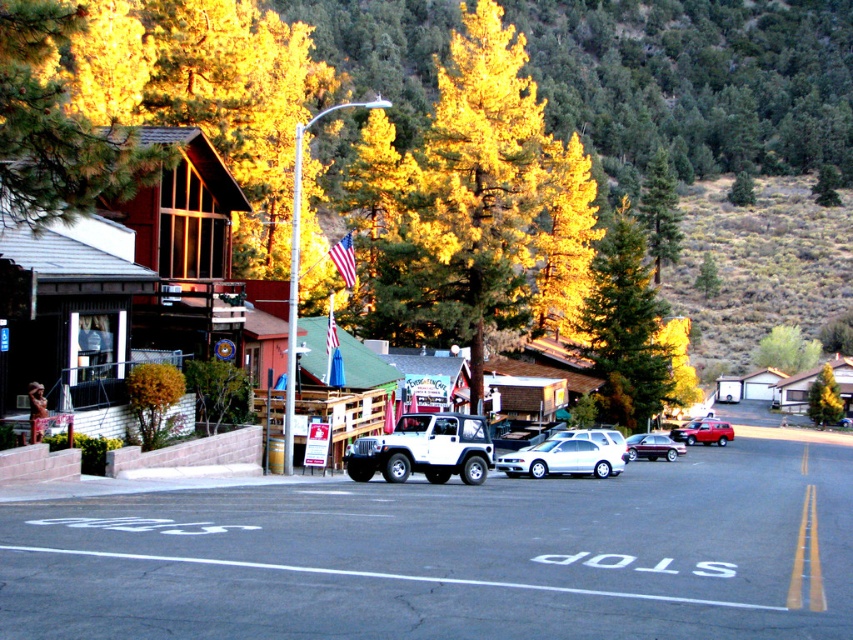
Measure the distance between point (643, 211) and camera.

Point (643, 211) and camera are 126.14 meters apart.

In the scene shown: Between green leafy tree at center and metallic maroon sedan at center, which one appears on the left side from the viewer's perspective?

From the viewer's perspective, metallic maroon sedan at center appears more on the left side.

Is point (650, 196) closer to viewer compared to point (683, 445)?

No, (650, 196) is behind (683, 445).

Identify the location of green leafy tree at center. The image size is (853, 640). (660, 211).

Does green textured tree at center have a larger size compared to white glossy sedan at center?

Indeed, green textured tree at center has a larger size compared to white glossy sedan at center.

Between green textured tree at center and white glossy sedan at center, which one has more height?

green textured tree at center is taller.

Between point (624, 330) and point (552, 435), which one is positioned behind?

The point (624, 330) is behind.

Where is `green textured tree at center`? This screenshot has width=853, height=640. green textured tree at center is located at coordinates (627, 326).

Can you confirm if golden pine tree at center is wider than green leafy tree at center?

Incorrect, golden pine tree at center's width does not surpass green leafy tree at center's.

In order to click on golden pine tree at center in this screenshot , I will do `click(488, 204)`.

You are a GUI agent. You are given a task and a screenshot of the screen. Output one action in this format:
    pyautogui.click(x=<x>, y=<y>)
    Task: Click on the golden pine tree at center
    Image resolution: width=853 pixels, height=640 pixels.
    Given the screenshot: What is the action you would take?
    pyautogui.click(x=488, y=204)